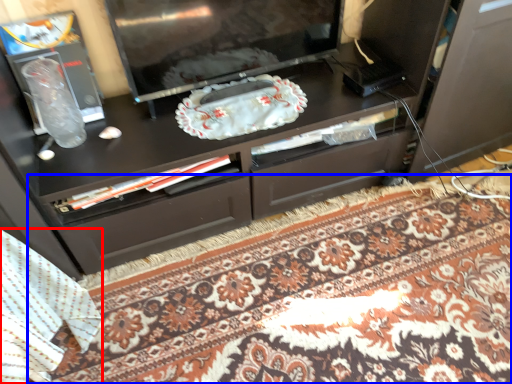
Question: Which object is closer to the camera taking this photo, blanket (highlighted by a red box) or mat (highlighted by a blue box)?

Choices:
 (A) blanket
 (B) mat

Answer: (A)